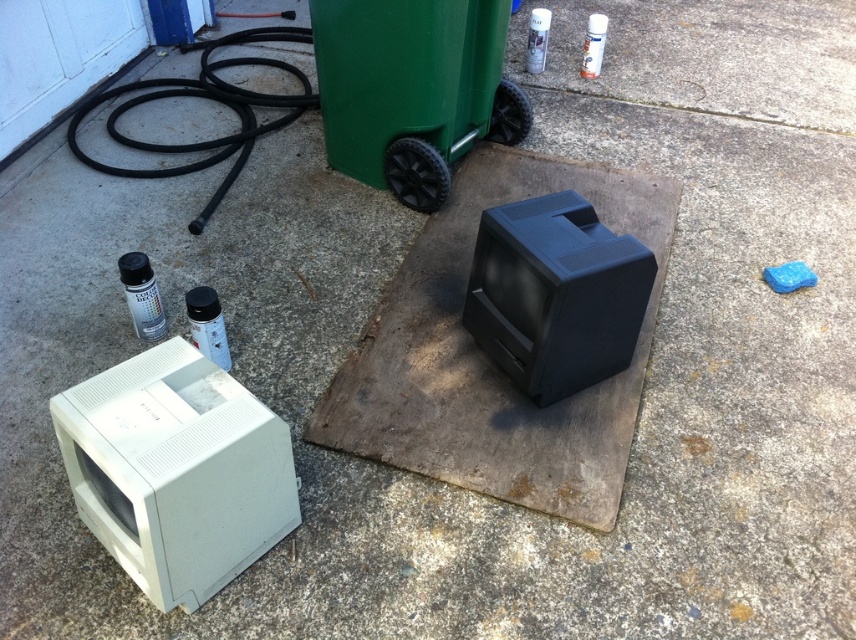
Question: Considering the real-world distances, which object is closest to the black plastic television at center?

Choices:
 (A) white plastic monitor at lower left
 (B) glossy plastic spray can at upper center
 (C) matte black spray can at lower left
 (D) green plastic recycling bin at center

Answer: (D)

Question: Can you confirm if green plastic recycling bin at center is positioned below glossy plastic spray can at upper center?

Choices:
 (A) yes
 (B) no

Answer: (A)

Question: Where is green plastic recycling bin at center located in relation to metallic spray can at lower left in the image?

Choices:
 (A) right
 (B) left

Answer: (A)

Question: Which object is the farthest from the white plastic monitor at lower left?

Choices:
 (A) glossy plastic spray can at upper center
 (B) green plastic recycling bin at center
 (C) black plastic television at center

Answer: (A)

Question: Can you confirm if green plastic recycling bin at center is smaller than black plastic television at center?

Choices:
 (A) yes
 (B) no

Answer: (B)

Question: Based on their relative distances, which object is farther from the black plastic television at center?

Choices:
 (A) glossy plastic spray can at upper center
 (B) matte black spray can at lower left
 (C) metallic spray can at lower left
 (D) white plastic monitor at lower left

Answer: (A)